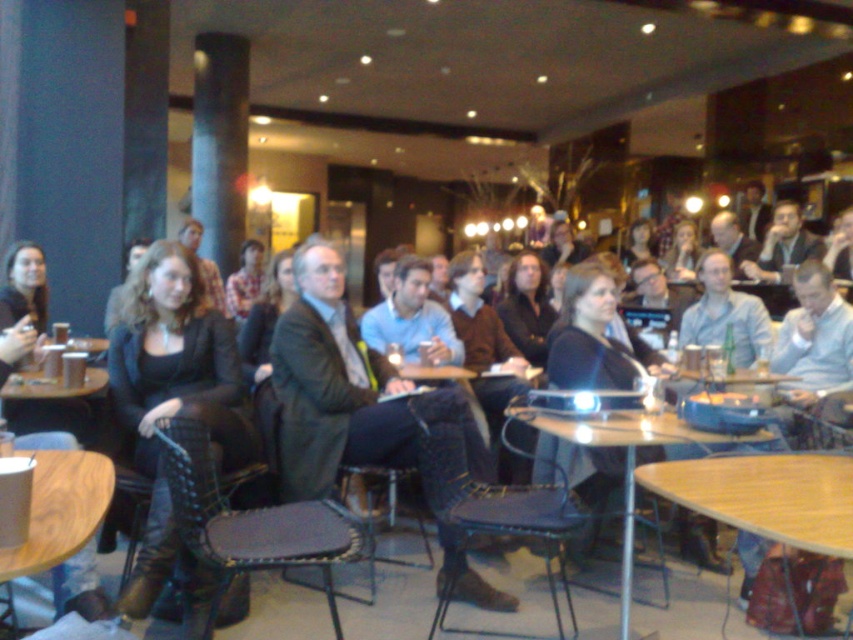
Who is positioned more to the left, matte black jacket at center or dark blue fabric chair at center?

From the viewer's perspective, dark blue fabric chair at center appears more on the left side.

Can you confirm if matte black jacket at center is shorter than dark blue fabric chair at center?

Yes, matte black jacket at center is shorter than dark blue fabric chair at center.

This screenshot has height=640, width=853. Identify the location of matte black jacket at center. point(686,604).

Who is higher up, leather boots at center or light wood round table at lower right?

leather boots at center

Can you confirm if leather boots at center is positioned to the right of light wood round table at lower right?

Incorrect, leather boots at center is not on the right side of light wood round table at lower right.

Does point (184, 276) come in front of point (714, 467)?

No.

Where is `leather boots at center`? leather boots at center is located at coordinates coord(172,392).

Who is higher up, black woven chair at center or dark blue fabric chair at center?

black woven chair at center

This screenshot has width=853, height=640. Describe the element at coordinates (247, 522) in the screenshot. I see `black woven chair at center` at that location.

The height and width of the screenshot is (640, 853). Identify the location of black woven chair at center. (247, 522).